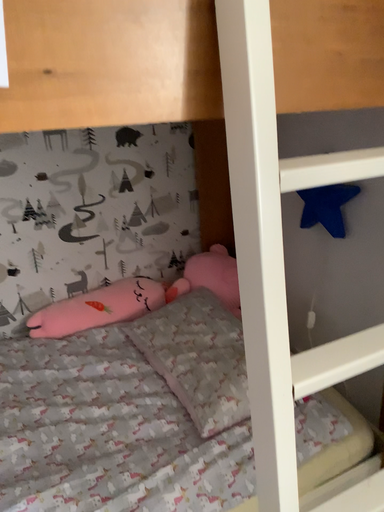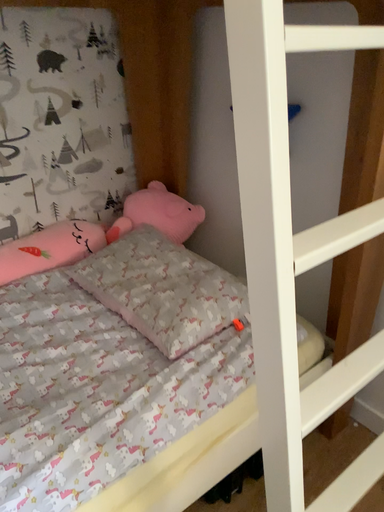
Question: How did the camera likely rotate when shooting the video?

Choices:
 (A) rotated right
 (B) rotated left

Answer: (A)